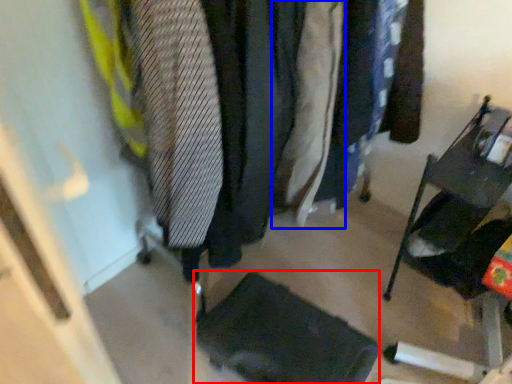
Question: Which object is further to the camera taking this photo, footrest (highlighted by a red box) or clothing (highlighted by a blue box)?

Choices:
 (A) footrest
 (B) clothing

Answer: (A)